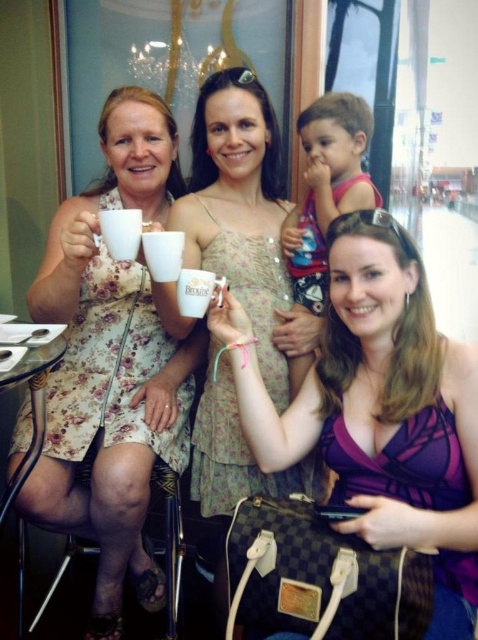
Question: Which point appears farthest from the camera in this image?

Choices:
 (A) (208, 298)
 (B) (364, 104)
 (C) (339, 412)
 (D) (155, 268)

Answer: (B)

Question: Among these objects, which one is nearest to the camera?

Choices:
 (A) white matte mug at upper center
 (B) white ceramic mug at center
 (C) white glossy mug at center

Answer: (A)

Question: Is purple fabric dress at center below matte floral dress at center?

Choices:
 (A) no
 (B) yes

Answer: (B)

Question: Observing the image, what is the correct spatial positioning of matte floral dress at center in reference to white glossy mug at center?

Choices:
 (A) above
 (B) below

Answer: (B)

Question: Which of the following is the closest to the observer?

Choices:
 (A) white ceramic mug at center
 (B) purple fabric dress at center

Answer: (B)

Question: Is matte floral dress at center positioned in front of white matte mug at upper center?

Choices:
 (A) no
 (B) yes

Answer: (A)